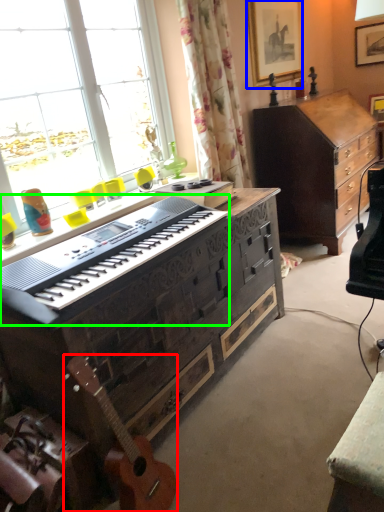
Question: Estimate the real-world distances between objects in this image. Which object is farther from guitar (highlighted by a red box), picture frame (highlighted by a blue box) or piano (highlighted by a green box)?

Choices:
 (A) picture frame
 (B) piano

Answer: (A)